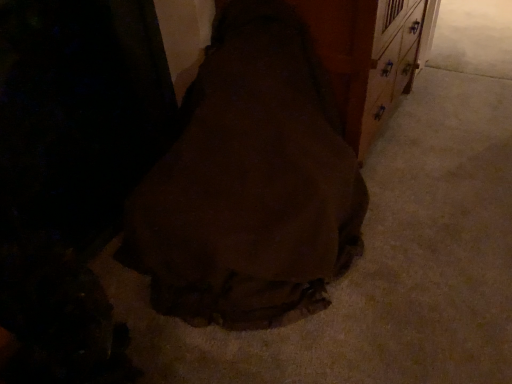
Question: Is point (259, 278) positioned closer to the camera than point (356, 110)?

Choices:
 (A) farther
 (B) closer

Answer: (B)

Question: From a real-world perspective, relative to brown wood dresser at center, is brown fabric bag at center vertically above or below?

Choices:
 (A) above
 (B) below

Answer: (A)

Question: Is brown fabric bag at center situated inside brown wood dresser at center or outside?

Choices:
 (A) outside
 (B) inside

Answer: (A)

Question: From the image's perspective, is brown wood dresser at center positioned above or below brown fabric bag at center?

Choices:
 (A) above
 (B) below

Answer: (A)

Question: In the image, is brown wood dresser at center on the left side or the right side of brown fabric bag at center?

Choices:
 (A) right
 (B) left

Answer: (A)

Question: Is brown wood dresser at center spatially inside brown fabric bag at center, or outside of it?

Choices:
 (A) inside
 (B) outside

Answer: (B)

Question: Is point (331, 81) closer or farther from the camera than point (176, 177)?

Choices:
 (A) farther
 (B) closer

Answer: (A)